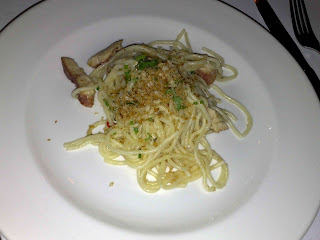
The image size is (320, 240). I want to click on tablecloth, so click(x=7, y=9), click(x=250, y=8).